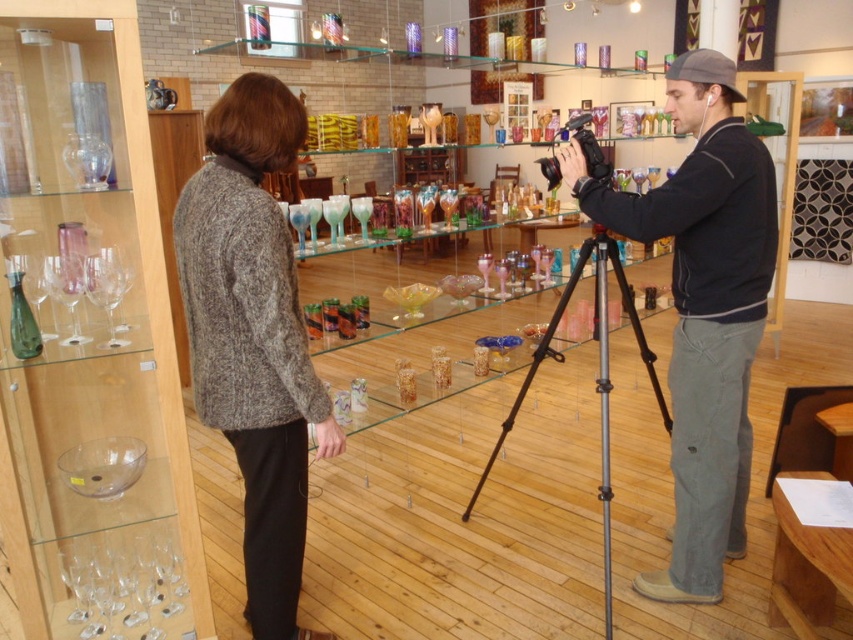
Which is above, dark gray sweatshirt at center or silver metallic tripod at center?

dark gray sweatshirt at center is higher up.

Can you confirm if dark gray sweatshirt at center is smaller than silver metallic tripod at center?

Yes, dark gray sweatshirt at center is smaller than silver metallic tripod at center.

Where is `dark gray sweatshirt at center`? This screenshot has height=640, width=853. dark gray sweatshirt at center is located at coordinates (703, 308).

Locate an element on the screen. dark gray sweatshirt at center is located at coordinates [x=703, y=308].

Does point (672, 177) lie in front of point (552, 188)?

Yes.

Is point (741, 280) farther from viewer compared to point (589, 115)?

No, it is not.

This screenshot has width=853, height=640. What are the coordinates of `dark gray sweatshirt at center` in the screenshot? It's located at (703, 308).

Which is in front, point (97, 449) or point (187, 220)?

Positioned in front is point (187, 220).

In order to click on clear glass vase at left in this screenshot , I will do (x=90, y=340).